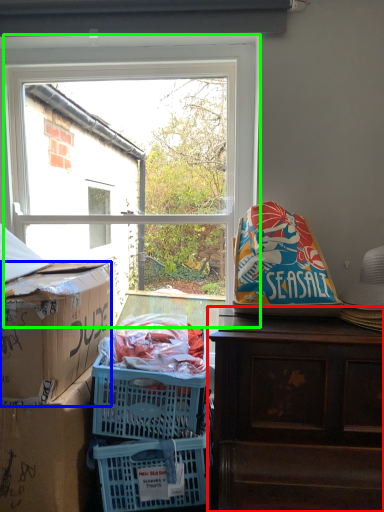
Question: Considering the real-world distances, which object is closest to desk (highlighted by a red box)? box (highlighted by a blue box) or window (highlighted by a green box).

Choices:
 (A) box
 (B) window

Answer: (A)